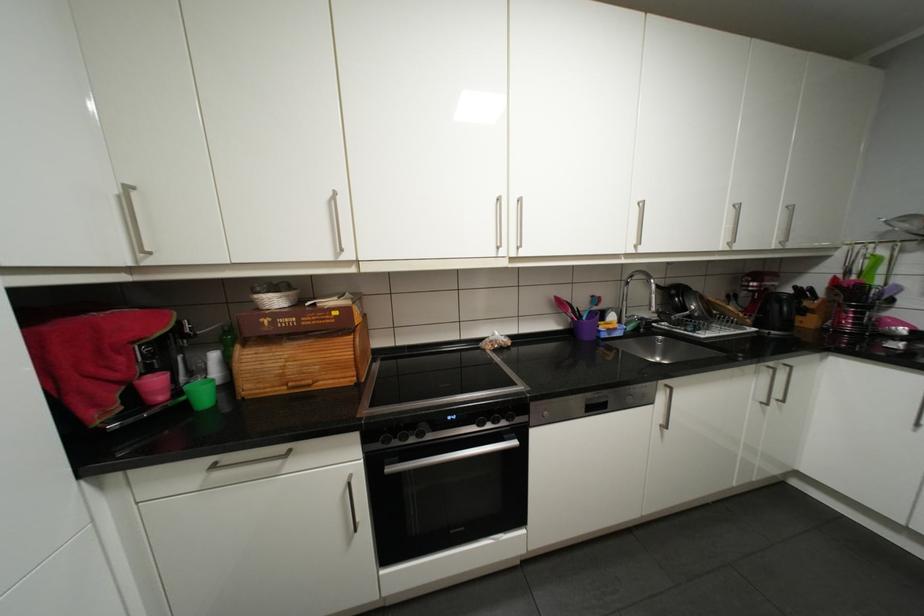
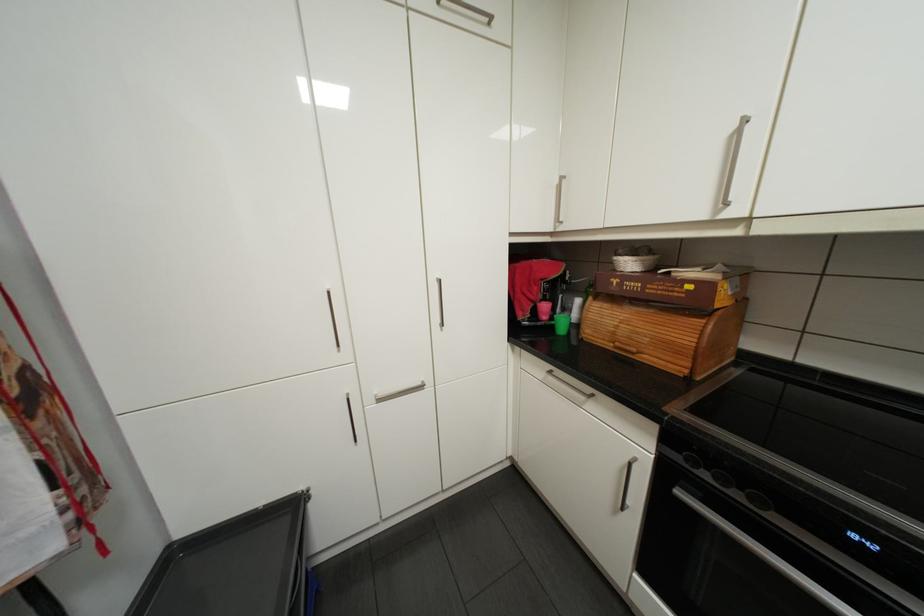
In the second image, find the point that corresponds to (419,439) in the first image.

(746, 493)